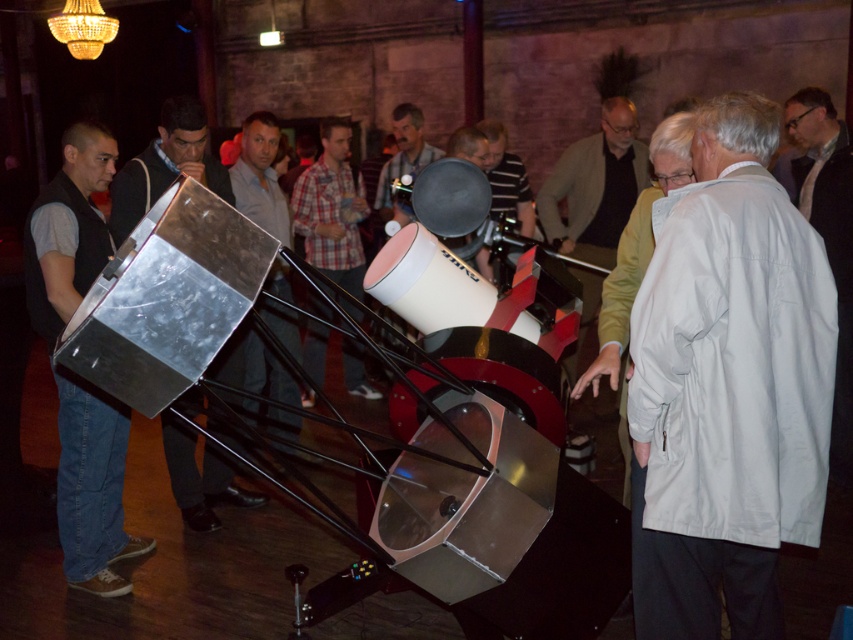
You are a security guard in the room and you need to locate the light brown leather jacket at center. According to the coordinates provided, where exactly would you find it?

The light brown leather jacket at center is located at point coordinates of (595, 186).

You are standing in front of the telescope and notice two points marked on its cylindrical body. The first point is located at coordinates point (593,256) and the second at point (514,208). Which of these points is nearer to your current position?

Point (593,256) is closer to the viewer than point (514,208), so the first point is nearer to your current position.

You are standing at the camera position in the scene. There is a point marked at coordinates point (838, 227). Can you reach this point without moving your position?

The point (838, 227) is 13.73 feet away from the camera position. Since you are standing at the camera position, you cannot reach the point without moving since it is too far away.